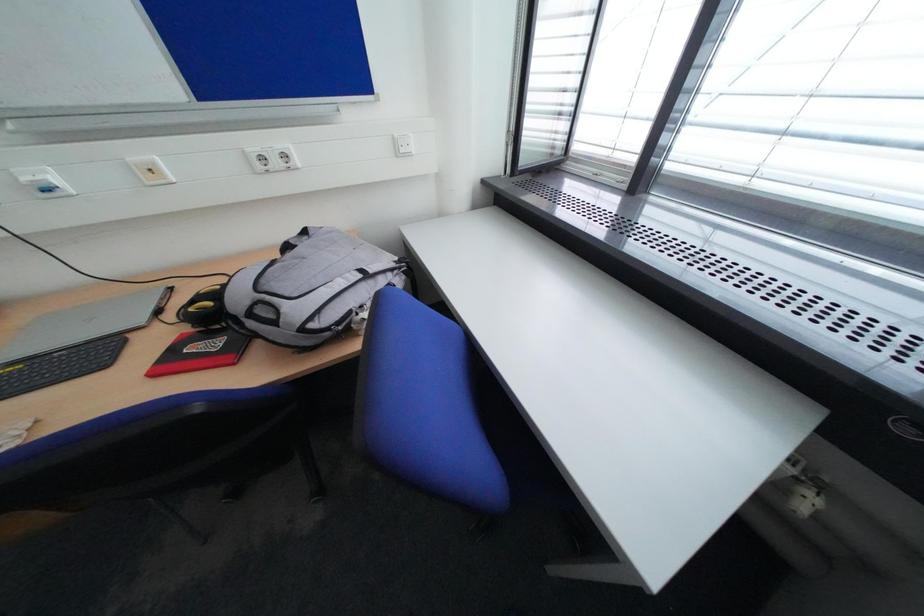
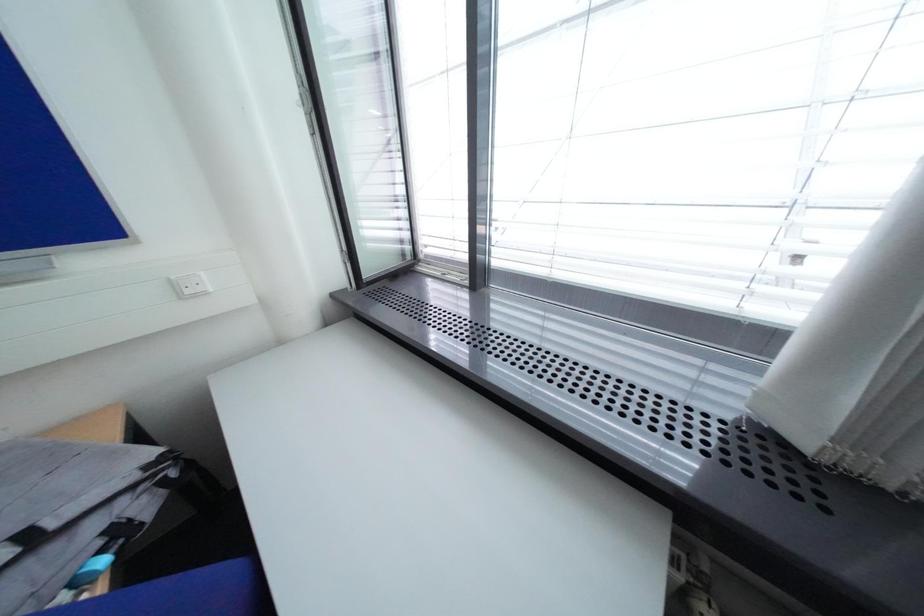
Question: The camera is either moving clockwise (left) or counter-clockwise (right) around the object. The first image is from the beginning of the video and the second image is from the end. Is the camera moving left or right when shooting the video?

Choices:
 (A) Left
 (B) Right

Answer: (A)